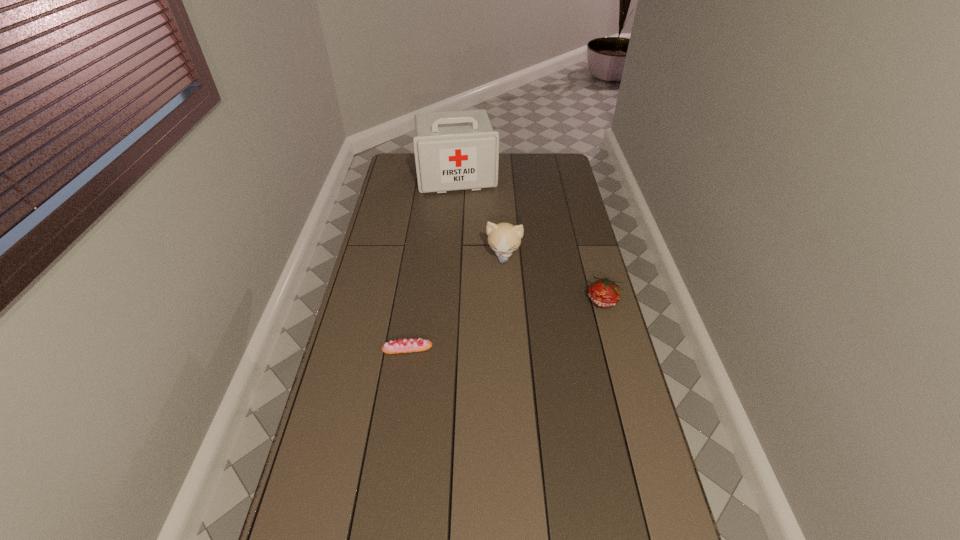
Where is `object that is positioned at the far left corner`? object that is positioned at the far left corner is located at coordinates (457, 150).

The width and height of the screenshot is (960, 540). In the image, there is a desktop. What are the coordinates of `vacant space at the far edge` in the screenshot? It's located at (520, 165).

What are the coordinates of `free spot at the near edge of the desktop` in the screenshot? It's located at (389, 531).

The image size is (960, 540). Find the location of `free space at the left edge of the desktop`. free space at the left edge of the desktop is located at coordinates (362, 275).

Locate an element on the screen. Image resolution: width=960 pixels, height=540 pixels. free space at the right edge of the desktop is located at coordinates (561, 193).

The width and height of the screenshot is (960, 540). In the image, there is a desktop. What are the coordinates of `vacant space at the far left corner` in the screenshot? It's located at (414, 172).

Where is `vacant space at the far right corner of the desktop`? vacant space at the far right corner of the desktop is located at coordinates (562, 169).

You are a GUI agent. You are given a task and a screenshot of the screen. Output one action in this format:
    pyautogui.click(x=<x>, y=<y>)
    Task: Click on the empty location between the tomato and the shortest object
    
    Given the screenshot: What is the action you would take?
    pyautogui.click(x=506, y=325)

This screenshot has height=540, width=960. In order to click on empty location between the rightmost object and the nearest object in this screenshot , I will do `click(506, 325)`.

Where is `free point between the second tallest object and the third farthest object`? The height and width of the screenshot is (540, 960). free point between the second tallest object and the third farthest object is located at coordinates (554, 278).